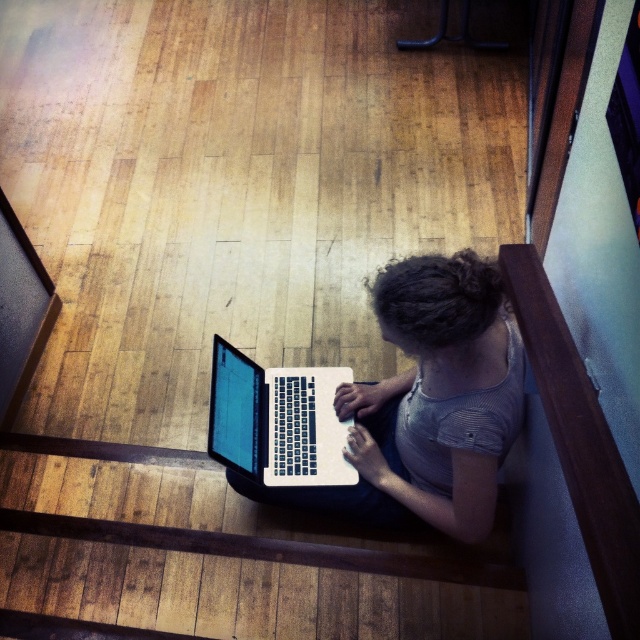
Question: Does white matte laptop at center come in front of white glossy laptop at lower center?

Choices:
 (A) no
 (B) yes

Answer: (B)

Question: In this image, where is white matte laptop at center located relative to white glossy laptop at lower center?

Choices:
 (A) left
 (B) right

Answer: (B)

Question: Does white matte laptop at center have a greater width compared to white glossy laptop at lower center?

Choices:
 (A) no
 (B) yes

Answer: (B)

Question: Which point is farther from the camera taking this photo?

Choices:
 (A) [x=237, y=388]
 (B) [x=483, y=467]

Answer: (A)

Question: Which point is closer to the camera taking this photo?

Choices:
 (A) [227, 422]
 (B) [435, 403]

Answer: (B)